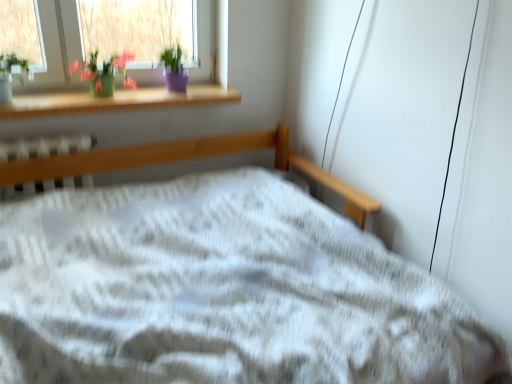
Describe the element at coordinates (114, 101) in the screenshot. I see `wooden at upper left` at that location.

Identify the location of green matte vase at upper left. (103, 72).

Where is `white plastic radiator at center`? white plastic radiator at center is located at coordinates (45, 146).

Is green matte vase at upper left not near white plastic radiator at center?

They are positioned close to each other.

Between green matte vase at upper left and white plastic radiator at center, which one is positioned behind?

green matte vase at upper left is behind.

In the scene shown: From the image's perspective, would you say green matte vase at upper left is positioned over white plastic radiator at center?

Yes.

From a real-world perspective, relative to white plastic radiator at center, is green matte vase at upper left vertically above or below?

From a real-world perspective, green matte vase at upper left is physically above white plastic radiator at center.

At what (x,y) coordinates should I click in order to perform the action: click on radiator below the green matte vase at upper left (from the image's perspective). Please return your answer as a coordinate pair (x, y). Looking at the image, I should click on (45, 146).

From their relative heights in the image, would you say white plastic radiator at center is taller or shorter than green matte vase at upper left?

white plastic radiator at center is taller than green matte vase at upper left.

Is white plastic radiator at center aimed at green matte vase at upper left?

No, white plastic radiator at center is not facing towards green matte vase at upper left.

From a real-world perspective, does white plastic radiator at center stand above green matte vase at upper left?

Incorrect, from a real-world perspective, white plastic radiator at center is lower than green matte vase at upper left.

Between green matte vase at upper left and wooden at upper left, which one has smaller size?

With smaller size is green matte vase at upper left.

Is green matte vase at upper left placed right next to wooden at upper left?

green matte vase at upper left and wooden at upper left are not in contact.

From a real-world perspective, relative to wooden at upper left, is green matte vase at upper left vertically above or below?

green matte vase at upper left is above wooden at upper left.

Considering the sizes of objects green matte vase at upper left and wooden at upper left in the image provided, who is taller, green matte vase at upper left or wooden at upper left?

green matte vase at upper left.

Is point (20, 139) closer to viewer compared to point (144, 100)?

Yes, it is in front of point (144, 100).

How many degrees apart are the facing directions of white plastic radiator at center and wooden at upper left?

They differ by 1.98 degrees in their facing directions.

Considering the sizes of objects white plastic radiator at center and wooden at upper left in the image provided, who is smaller, white plastic radiator at center or wooden at upper left?

wooden at upper left is smaller.

Does white plastic radiator at center have a lesser height compared to wooden at upper left?

In fact, white plastic radiator at center may be taller than wooden at upper left.

From the image's perspective, who appears lower, wooden at upper left or white plastic radiator at center?

white plastic radiator at center is shown below in the image.

Does wooden at upper left turn towards white plastic radiator at center?

No, wooden at upper left does not turn towards white plastic radiator at center.

Is wooden at upper left further to camera compared to white plastic radiator at center?

Yes, wooden at upper left is further from the viewer.

Can you confirm if wooden at upper left is positioned to the left of white plastic radiator at center?

No.

Between wooden at upper left and green matte vase at upper left, which one has less height?

With less height is wooden at upper left.

Considering the positions of points (50, 105) and (95, 82), is point (50, 105) closer to camera compared to point (95, 82)?

Yes, it is.

From a real-world perspective, is wooden at upper left under green matte vase at upper left?

Indeed, from a real-world perspective, wooden at upper left is positioned beneath green matte vase at upper left.

Identify the location of floral arrangement that is behind the white plastic radiator at center. (103, 72).

Where is `radiator below the green matte vase at upper left (from the image's perspective)`? This screenshot has height=384, width=512. radiator below the green matte vase at upper left (from the image's perspective) is located at coordinates (45, 146).

Considering their positions, is wooden at upper left positioned closer to green matte vase at upper left than white plastic radiator at center?

Among the two, wooden at upper left is located nearer to green matte vase at upper left.

Based on the photo, from the image, which object appears to be nearer to wooden at upper left, white plastic radiator at center or green matte vase at upper left?

green matte vase at upper left is positioned closer to the anchor wooden at upper left.

Based on their spatial positions, is green matte vase at upper left or white plastic radiator at center further from wooden at upper left?

white plastic radiator at center.

Looking at the image, which one is located closer to green matte vase at upper left, white plastic radiator at center or wooden at upper left?

Among the two, wooden at upper left is located nearer to green matte vase at upper left.

Estimate the real-world distances between objects in this image. Which object is further from white plastic radiator at center, green matte vase at upper left or wooden at upper left?

green matte vase at upper left lies further to white plastic radiator at center than the other object.

From the image, which object appears to be farther from white plastic radiator at center, wooden at upper left or green matte vase at upper left?

Among the two, green matte vase at upper left is located further to white plastic radiator at center.

The image size is (512, 384). Find the location of `window sill between green matte vase at upper left and white plastic radiator at center in the vertical direction`. window sill between green matte vase at upper left and white plastic radiator at center in the vertical direction is located at coordinates (114, 101).